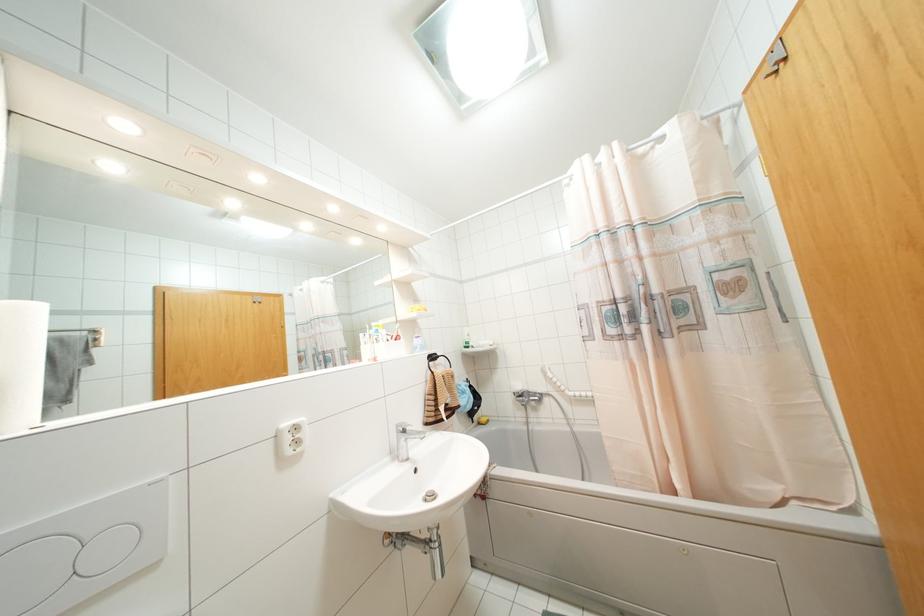
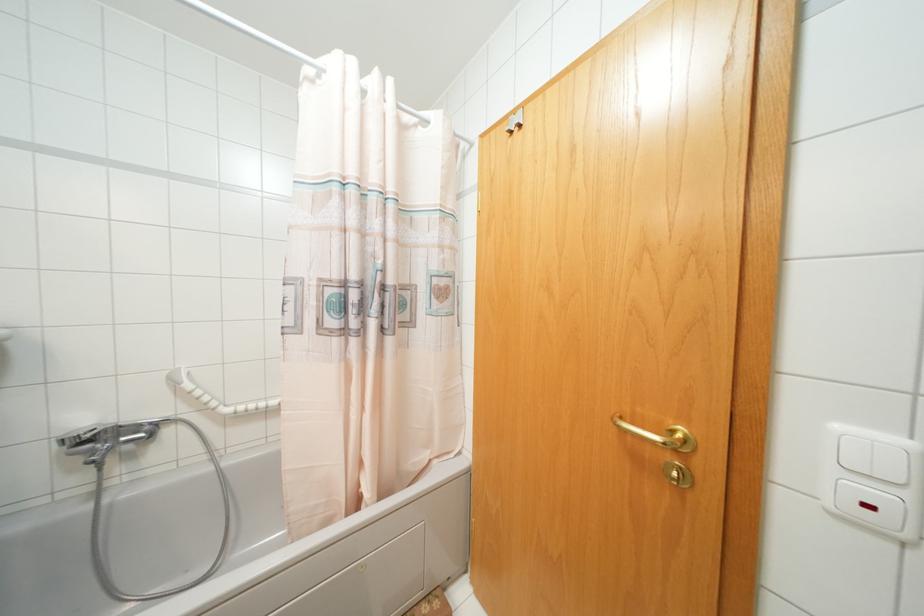
The point at (775, 71) is marked in the first image. Where is the corresponding point in the second image?

(511, 132)